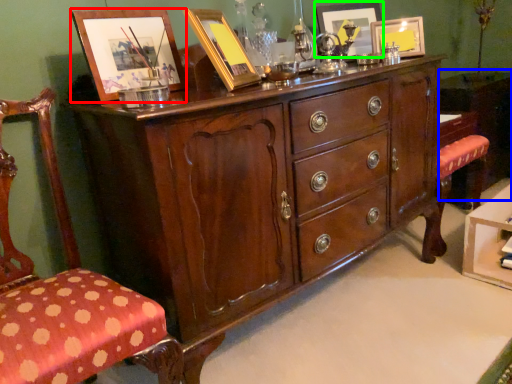
Question: Which object is positioned closest to picture frame (highlighted by a red box)? Select from vanity (highlighted by a blue box) and picture frame (highlighted by a green box).

Choices:
 (A) vanity
 (B) picture frame

Answer: (B)